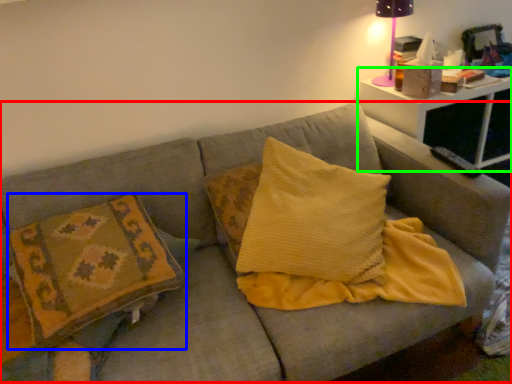
Question: Considering the real-world distances, which object is closest to couch (highlighted by a red box)? pillow (highlighted by a blue box) or table (highlighted by a green box).

Choices:
 (A) pillow
 (B) table

Answer: (A)